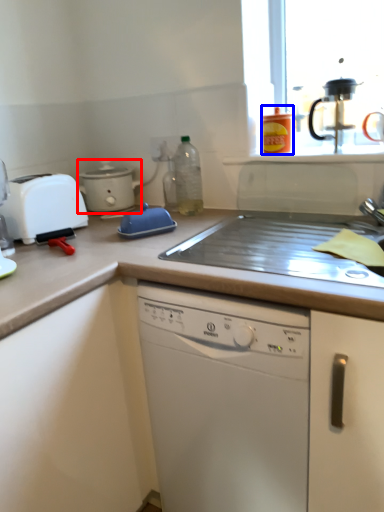
Question: Which of the following is the closest to the observer, kitchen appliance (highlighted by a red box) or kitchen appliance (highlighted by a blue box)?

Choices:
 (A) kitchen appliance
 (B) kitchen appliance

Answer: (B)